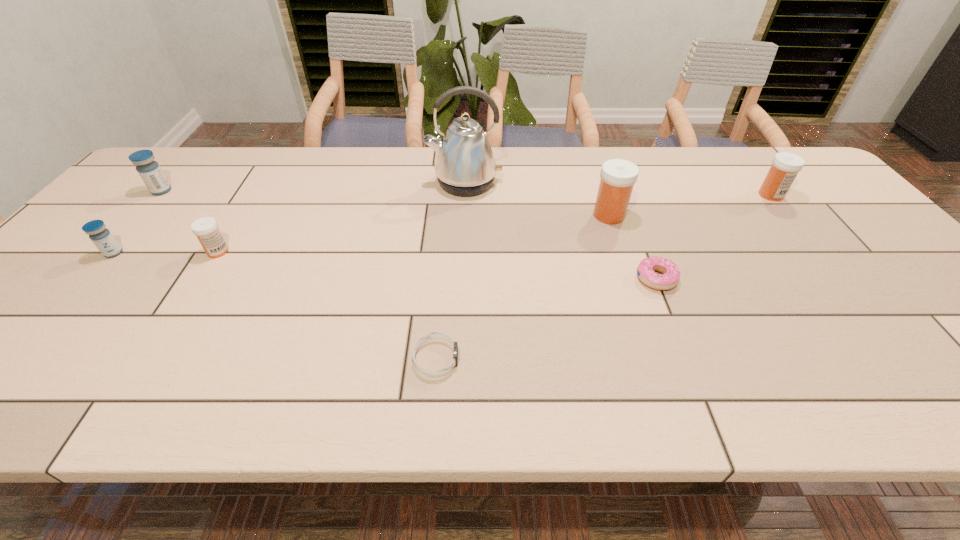
Where is `kettle present at the far edge`? The height and width of the screenshot is (540, 960). kettle present at the far edge is located at coordinates (465, 165).

This screenshot has width=960, height=540. In order to click on object present at the near edge in this screenshot , I will do `click(432, 335)`.

At what (x,y) coordinates should I click in order to perform the action: click on object that is positioned at the right edge. Please return your answer as a coordinate pair (x, y). This screenshot has height=540, width=960. Looking at the image, I should click on [x=785, y=166].

Where is `object at the far left corner`? object at the far left corner is located at coordinates (149, 170).

Locate an element on the screen. object that is at the far right corner is located at coordinates (785, 166).

Identify the location of free space at the far edge of the desktop. (594, 184).

You are a GUI agent. You are given a task and a screenshot of the screen. Output one action in this format:
    pyautogui.click(x=<x>, y=<y>)
    Task: Click on the vacant area at the left edge
    The width and height of the screenshot is (960, 540).
    Given the screenshot: What is the action you would take?
    pyautogui.click(x=138, y=217)

Locate an element on the screen. free space at the right edge of the desktop is located at coordinates (878, 241).

Locate an element on the screen. vacant space at the far left corner of the desktop is located at coordinates (202, 158).

Where is `empty location between the nearest white medicine and the nearer blue medicine`? empty location between the nearest white medicine and the nearer blue medicine is located at coordinates tap(166, 252).